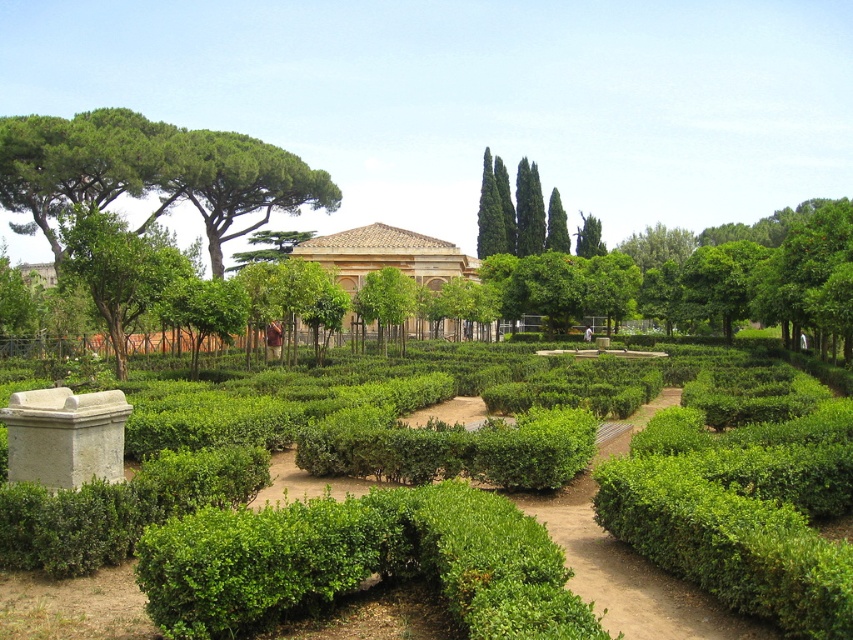
Question: In this image, where is green leafy tree at upper left located relative to green leafy tree at upper center?

Choices:
 (A) left
 (B) right

Answer: (A)

Question: Which of the following is the closest to the observer?

Choices:
 (A) (448, 264)
 (B) (247, 192)
 (C) (490, 196)

Answer: (A)

Question: Which object is the farthest from the green leafy tree at upper left?

Choices:
 (A) brown stone building at center
 (B) green leafy tree at upper center

Answer: (B)

Question: Considering the relative positions of green leafy tree at upper left and green leafy tree at upper center in the image provided, where is green leafy tree at upper left located with respect to green leafy tree at upper center?

Choices:
 (A) right
 (B) left

Answer: (B)

Question: Which object appears farthest from the camera in this image?

Choices:
 (A) green leafy tree at upper center
 (B) brown stone building at center
 (C) green leafy tree at upper left

Answer: (A)

Question: Is green leafy tree at upper left bigger than green leafy tree at upper center?

Choices:
 (A) no
 (B) yes

Answer: (B)